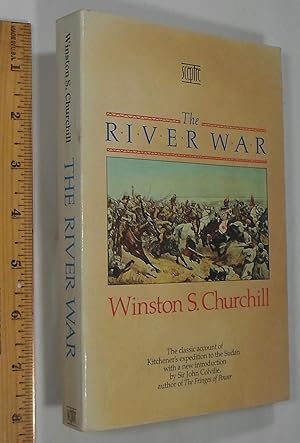
Where is `gray shadow cast by book`? Image resolution: width=300 pixels, height=443 pixels. gray shadow cast by book is located at coordinates (229, 421).